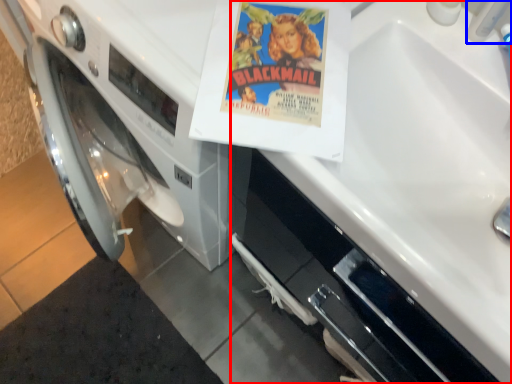
Question: Which object appears closest to the camera in this image, sink (highlighted by a red box) or faucet (highlighted by a blue box)?

Choices:
 (A) sink
 (B) faucet

Answer: (A)